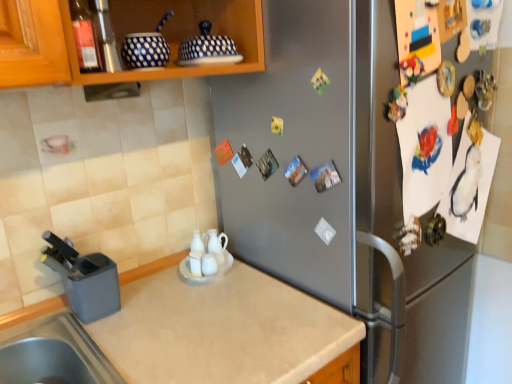
This screenshot has width=512, height=384. Find the location of `free point above beige laminate countertop at lower left (from a real-world perspective)`. free point above beige laminate countertop at lower left (from a real-world perspective) is located at coordinates (180, 325).